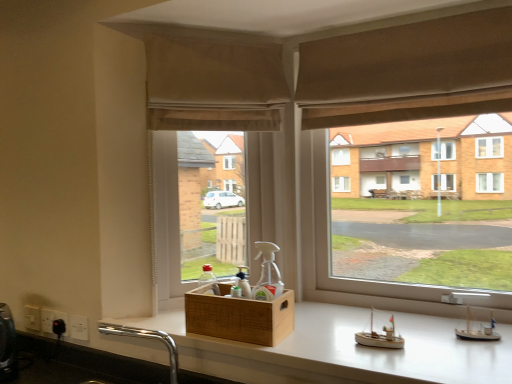
In order to face translucent plastic bottle at lower left, the first bottle positioned from the left, should I rotate leftwards or rightwards?

You should look left and rotate roughly 6.789 degrees.

The image size is (512, 384). Describe the element at coordinates (209, 279) in the screenshot. I see `translucent plastic bottle at lower left, the second bottle when ordered from right to left` at that location.

Where is `white glossy counter at center`? This screenshot has height=384, width=512. white glossy counter at center is located at coordinates (342, 350).

Image resolution: width=512 pixels, height=384 pixels. What are the coordinates of `wooden crate at center` in the screenshot? It's located at (239, 317).

Where is `matte brown curtain at center`? The image size is (512, 384). matte brown curtain at center is located at coordinates (411, 209).

Where is `brown fabric curtain at upper center`? This screenshot has width=512, height=384. brown fabric curtain at upper center is located at coordinates (409, 67).

From the image's perspective, between wooden crate at center and matte brown curtain at center, which one is located above?

matte brown curtain at center, from the image's perspective.

From the picture: Does wooden crate at center lie in front of matte brown curtain at center?

Yes.

In the scene shown: Considering the sizes of objects wooden crate at center and matte brown curtain at center in the image provided, who is smaller, wooden crate at center or matte brown curtain at center?

wooden crate at center is smaller.

From the picture: Considering the relative sizes of brown fabric curtain at upper center and white glossy counter at center in the image provided, is brown fabric curtain at upper center wider than white glossy counter at center?

No, brown fabric curtain at upper center is not wider than white glossy counter at center.

Based on the photo, from a real-world perspective, is brown fabric curtain at upper center below white glossy counter at center?

Incorrect, from a real-world perspective, brown fabric curtain at upper center is higher than white glossy counter at center.

Can you confirm if brown fabric curtain at upper center is bigger than white glossy counter at center?

No, brown fabric curtain at upper center is not bigger than white glossy counter at center.

Is transparent plastic spray bottle at center, which appears as the second bottle when viewed from the left, spatially inside matte brown curtain at center, or outside of it?

transparent plastic spray bottle at center, which appears as the second bottle when viewed from the left, is spatially situated outside matte brown curtain at center.

From the image's perspective, does transparent plastic spray bottle at center, the first bottle in the right-to-left sequence, appear lower than matte brown curtain at center?

Yes.

Considering the points (273, 291) and (496, 159), which point is in front, point (273, 291) or point (496, 159)?

The point (273, 291) is closer to the camera.

Consider the image. Which of these two, beige fabric window screen at center or brown fabric curtain at upper center, is thinner?

With smaller width is brown fabric curtain at upper center.

Considering the positions of point (195, 261) and point (471, 36), is point (195, 261) closer or farther from the camera than point (471, 36)?

Point (195, 261).

Is beige fabric window screen at center not within brown fabric curtain at upper center?

Yes.

Is the surface of beige fabric window screen at center in direct contact with brown fabric curtain at upper center?

No, beige fabric window screen at center is not in contact with brown fabric curtain at upper center.

Considering the sizes of objects transparent plastic spray bottle at center, which appears as the second bottle when viewed from the left, and beige fabric window screen at center in the image provided, who is bigger, transparent plastic spray bottle at center, which appears as the second bottle when viewed from the left, or beige fabric window screen at center?

beige fabric window screen at center.

Does transparent plastic spray bottle at center, the first bottle in the right-to-left sequence, lie behind beige fabric window screen at center?

No, transparent plastic spray bottle at center, the first bottle in the right-to-left sequence, is closer to the camera.

In order to click on window screen on the left side of transparent plastic spray bottle at center, the first bottle in the right-to-left sequence in this screenshot , I will do `click(197, 209)`.

Measure the distance between transparent plastic spray bottle at center, which appears as the second bottle when viewed from the left, and beige fabric window screen at center.

A distance of 14.06 inches exists between transparent plastic spray bottle at center, which appears as the second bottle when viewed from the left, and beige fabric window screen at center.

Which is behind, point (451, 14) or point (213, 291)?

The point (213, 291) is more distant.

Consider the image. Is brown fabric curtain at upper center looking in the opposite direction of translucent plastic bottle at lower left, the second bottle when ordered from right to left?

brown fabric curtain at upper center does not have its back to translucent plastic bottle at lower left, the second bottle when ordered from right to left.

Considering the sizes of objects brown fabric curtain at upper center and translucent plastic bottle at lower left, the second bottle when ordered from right to left, in the image provided, who is thinner, brown fabric curtain at upper center or translucent plastic bottle at lower left, the second bottle when ordered from right to left,?

With smaller width is translucent plastic bottle at lower left, the second bottle when ordered from right to left.

From the image's perspective, is translucent plastic bottle at lower left, the first bottle positioned from the left, below brown fabric curtain at upper center?

Yes, from the image's perspective, translucent plastic bottle at lower left, the first bottle positioned from the left, is below brown fabric curtain at upper center.

Between translucent plastic bottle at lower left, the first bottle positioned from the left, and brown fabric curtain at upper center, which one is positioned in front?

brown fabric curtain at upper center is more forward.

From a real-world perspective, between translucent plastic bottle at lower left, the first bottle positioned from the left, and brown fabric curtain at upper center, who is vertically lower?

In real-world perspective, translucent plastic bottle at lower left, the first bottle positioned from the left, is lower.

Is translucent plastic bottle at lower left, the first bottle positioned from the left, inside the boundaries of brown fabric curtain at upper center, or outside?

translucent plastic bottle at lower left, the first bottle positioned from the left, is not inside brown fabric curtain at upper center, it's outside.

The image size is (512, 384). Find the location of `window lying behind the wooden crate at center`. window lying behind the wooden crate at center is located at coordinates (411, 209).

In the image, there is a white glossy counter at center. At what (x,y) coordinates should I click in order to perform the action: click on curtain above it (from the image's perspective). Please return your answer as a coordinate pair (x, y). Looking at the image, I should click on (409, 67).

Based on the photo, looking at the image, which one is located closer to wooden crate at center, translucent plastic bottle at lower left, the second bottle when ordered from right to left, or beige fabric window screen at center?

translucent plastic bottle at lower left, the second bottle when ordered from right to left.

Considering their positions, is matte brown curtain at center positioned further to transparent plastic spray bottle at center, which appears as the second bottle when viewed from the left, than wooden crate at center?

The object further to transparent plastic spray bottle at center, which appears as the second bottle when viewed from the left, is matte brown curtain at center.

Looking at the image, which one is located further to transparent plastic spray bottle at center, which appears as the second bottle when viewed from the left, wooden crate at center or brown fabric curtain at upper center?

brown fabric curtain at upper center lies further to transparent plastic spray bottle at center, which appears as the second bottle when viewed from the left, than the other object.

From the image, which object appears to be farther from matte brown curtain at center, beige fabric window screen at center or brown fabric curtain at upper center?

beige fabric window screen at center is positioned further to the anchor matte brown curtain at center.

Which object lies further to the anchor point brown fabric curtain at upper center, beige fabric window screen at center or wooden crate at center?

Based on the image, wooden crate at center appears to be further to brown fabric curtain at upper center.

Estimate the real-world distances between objects in this image. Which object is further from brown fabric curtain at upper center, matte brown curtain at center or translucent plastic bottle at lower left, the second bottle when ordered from right to left?

translucent plastic bottle at lower left, the second bottle when ordered from right to left.

Looking at the image, which one is located closer to wooden crate at center, translucent plastic bottle at lower left, the first bottle positioned from the left, or brown fabric curtain at upper center?

translucent plastic bottle at lower left, the first bottle positioned from the left, lies closer to wooden crate at center than the other object.

From the image, which object appears to be farther from brown fabric curtain at upper center, beige fabric window screen at center or white glossy counter at center?

Based on the image, white glossy counter at center appears to be further to brown fabric curtain at upper center.

The width and height of the screenshot is (512, 384). Identify the location of bottle between beige fabric window screen at center and translucent plastic bottle at lower left, the first bottle positioned from the left, in the up-down direction. (268, 273).

The width and height of the screenshot is (512, 384). I want to click on window screen between translucent plastic bottle at lower left, the second bottle when ordered from right to left, and matte brown curtain at center, in the horizontal direction, so click(197, 209).

The height and width of the screenshot is (384, 512). In order to click on window screen between brown fabric curtain at upper center and wooden crate at center in the up-down direction in this screenshot , I will do `click(197, 209)`.

Identify the location of bottle situated between wooden crate at center and matte brown curtain at center from left to right. (268, 273).